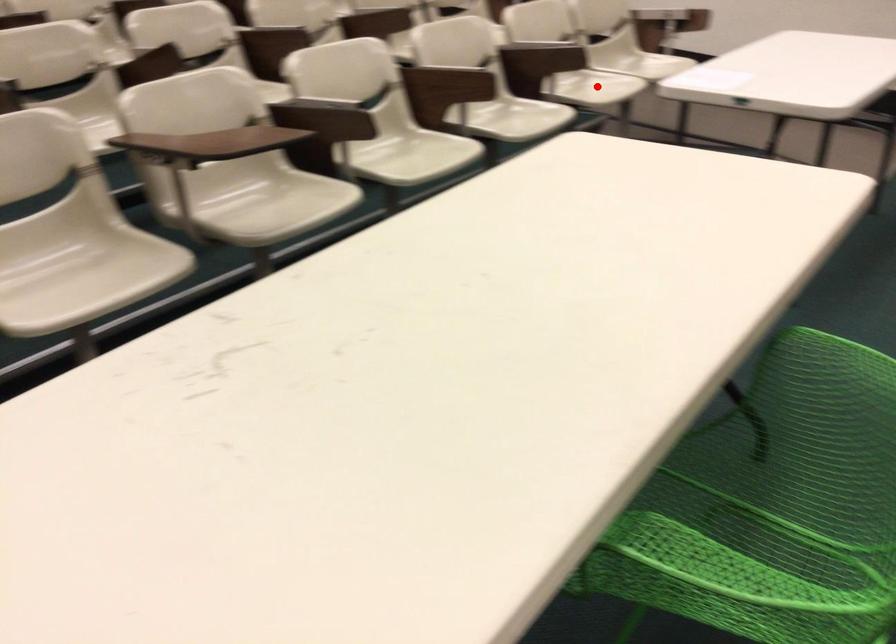
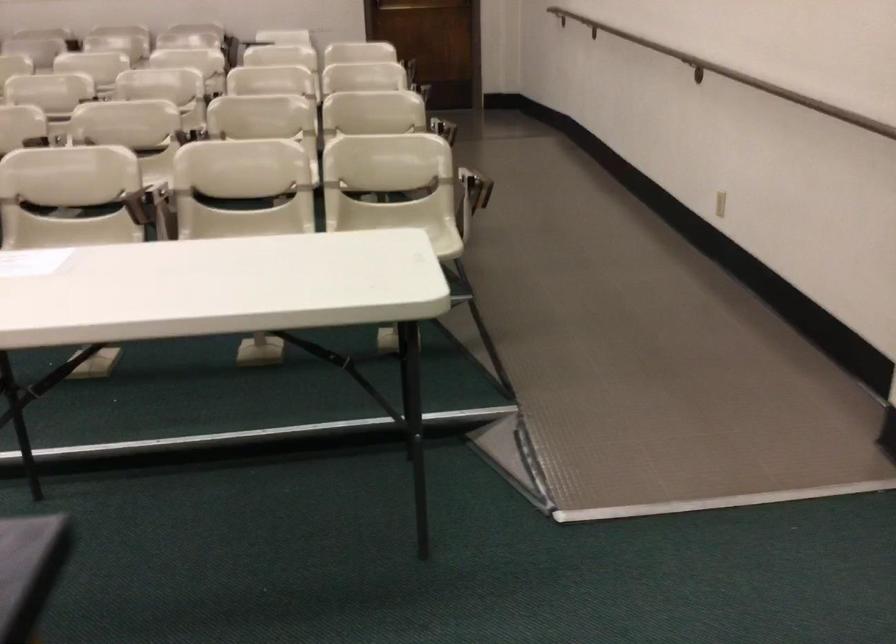
Question: I am providing you with two images of the same scene from different viewpoints. A red point is marked on the first image. Is the red point's position out of view in image 2?

Choices:
 (A) Yes
 (B) No

Answer: (A)